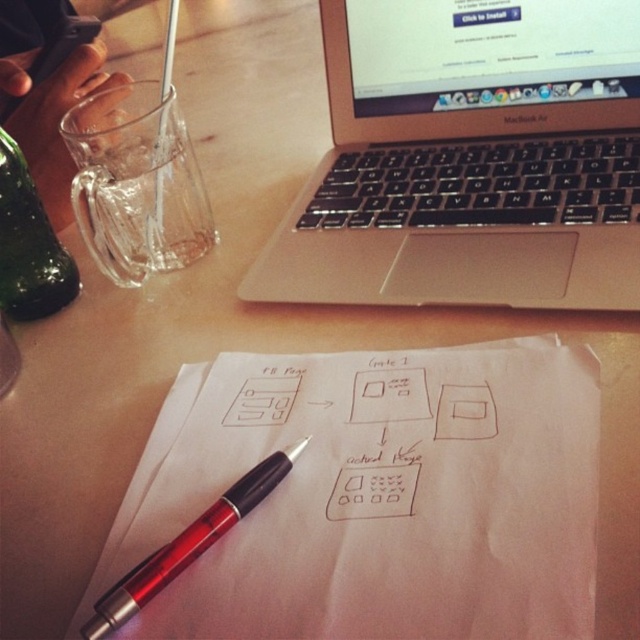
Is point (22, 276) less distant than point (108, 589)?

No, it is behind (108, 589).

This screenshot has height=640, width=640. Describe the element at coordinates (28, 244) in the screenshot. I see `green glass bottle at left` at that location.

This screenshot has height=640, width=640. What are the coordinates of `green glass bottle at left` in the screenshot? It's located at (28, 244).

Is matte paper notepad at center shorter than silver metallic laptop at upper center?

Correct, matte paper notepad at center is not as tall as silver metallic laptop at upper center.

Is matte paper notepad at center in front of silver metallic laptop at upper center?

Yes, it is in front of silver metallic laptop at upper center.

Find the location of a particular element. The image size is (640, 640). matte paper notepad at center is located at coordinates (376, 497).

What are the coordinates of `matte paper notepad at center` in the screenshot? It's located at (376, 497).

Is matte paper notepad at center bigger than green glass bottle at left?

Yes, matte paper notepad at center is bigger than green glass bottle at left.

The height and width of the screenshot is (640, 640). I want to click on matte paper notepad at center, so click(x=376, y=497).

Where is `matte paper notepad at center`? The width and height of the screenshot is (640, 640). matte paper notepad at center is located at coordinates (376, 497).